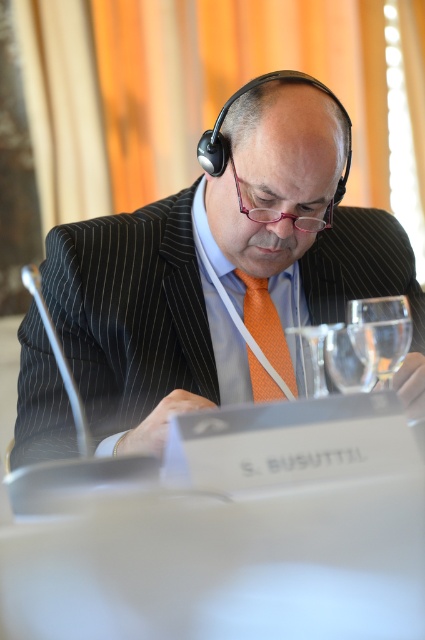
Question: Can you confirm if matte black suit at center is positioned above transparent glass at right?

Choices:
 (A) no
 (B) yes

Answer: (B)

Question: Among these objects, which one is nearest to the camera?

Choices:
 (A) orange textured tie at center
 (B) clear glass wine glass at center
 (C) matte black suit at center
 (D) transparent glass at right

Answer: (B)

Question: Which object appears closest to the camera in this image?

Choices:
 (A) orange textured tie at center
 (B) clear glass wine glass at center
 (C) matte black suit at center
 (D) transparent glass at right

Answer: (B)

Question: Which point appears closest to the camera in this image?

Choices:
 (A) (257, 364)
 (B) (379, 384)

Answer: (B)

Question: Can you confirm if matte black suit at center is positioned above transparent glass at right?

Choices:
 (A) no
 (B) yes

Answer: (B)

Question: Can you confirm if matte black suit at center is positioned to the right of transparent glass at right?

Choices:
 (A) no
 (B) yes

Answer: (A)